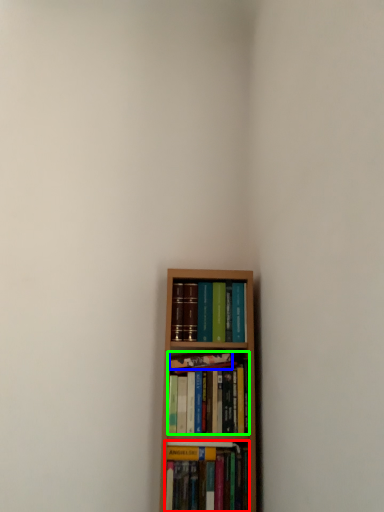
Question: Which object is positioned closest to book (highlighted by a red box)? Select from book (highlighted by a blue box) and book (highlighted by a green box).

Choices:
 (A) book
 (B) book

Answer: (B)